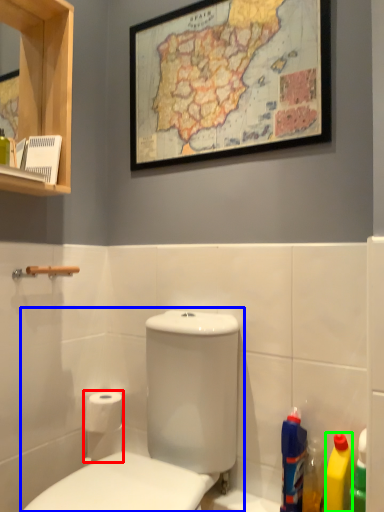
Question: Which object is positioned closest to toilet paper (highlighted by a red box)? Select from toilet (highlighted by a blue box) and cleaning product (highlighted by a green box).

Choices:
 (A) toilet
 (B) cleaning product

Answer: (A)